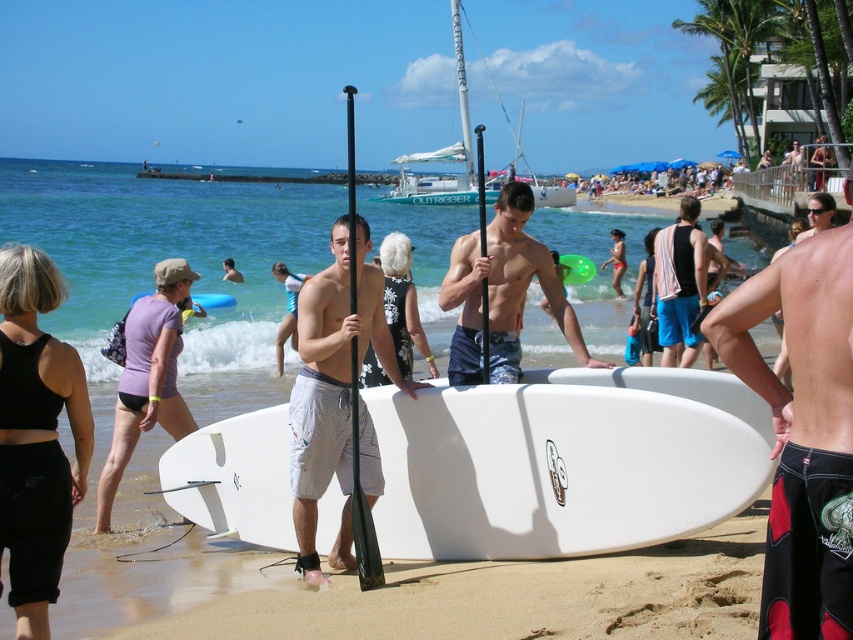
Question: Is black fabric shorts at lower left below matte blue shorts at center?

Choices:
 (A) no
 (B) yes

Answer: (B)

Question: Does white smooth surfboard at center have a smaller size compared to white mesh shorts at center?

Choices:
 (A) no
 (B) yes

Answer: (A)

Question: Which point is farther to the camera?

Choices:
 (A) (819, 595)
 (B) (544, 381)
 (C) (572, 284)

Answer: (C)

Question: Estimate the real-world distances between objects in this image. Which object is farther from the black textured board shorts at center?

Choices:
 (A) white smooth surfboard at center
 (B) matte blue shorts at center

Answer: (B)

Question: Is black textured board shorts at center below matte blue shorts at center?

Choices:
 (A) yes
 (B) no

Answer: (A)

Question: Considering the real-world distances, which object is closest to the white smooth surfboard at center?

Choices:
 (A) white matte surfboard at center
 (B) black fabric shorts at lower left
 (C) black textured board shorts at center
 (D) white mesh shorts at center

Answer: (D)